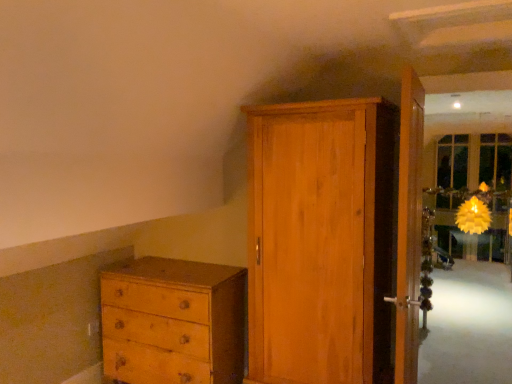
Question: Considering the positions of light brown wood chest of drawers at lower left and wooden door at right, which is counted as the first door, starting from the right, in the image, is light brown wood chest of drawers at lower left bigger or smaller than wooden door at right, which is counted as the first door, starting from the right,?

Choices:
 (A) small
 (B) big

Answer: (B)

Question: Is point (202, 354) positioned closer to the camera than point (404, 104)?

Choices:
 (A) farther
 (B) closer

Answer: (A)

Question: Considering the real-world distances, which object is closest to the wooden door at right, acting as the 2th door starting from the left?

Choices:
 (A) wooden wardrobe at center, the 1th door viewed from the left
 (B) light brown wood chest of drawers at lower left

Answer: (A)

Question: Which of these objects is positioned closest to the wooden door at right, acting as the 2th door starting from the left?

Choices:
 (A) light brown wood chest of drawers at lower left
 (B) wooden wardrobe at center, the second door viewed from the right

Answer: (B)